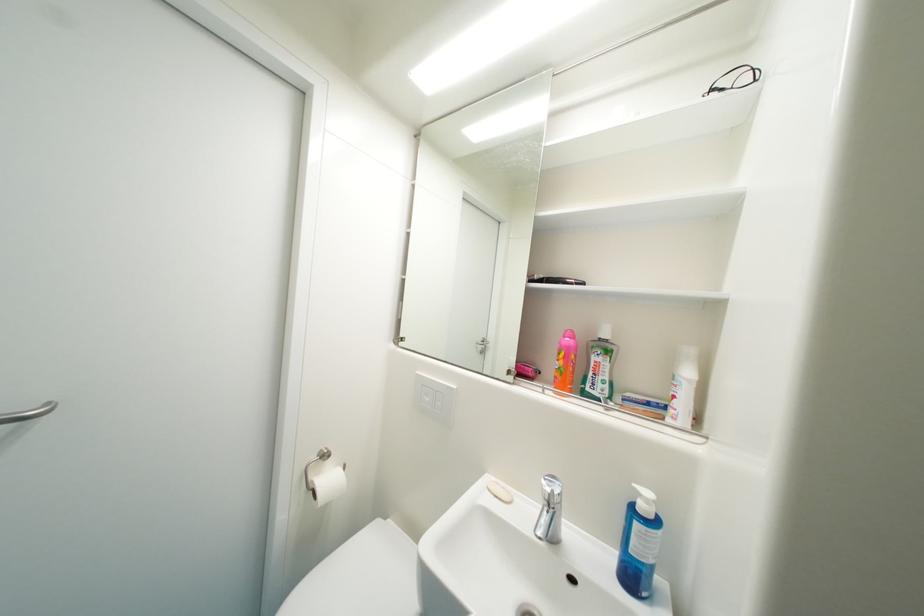
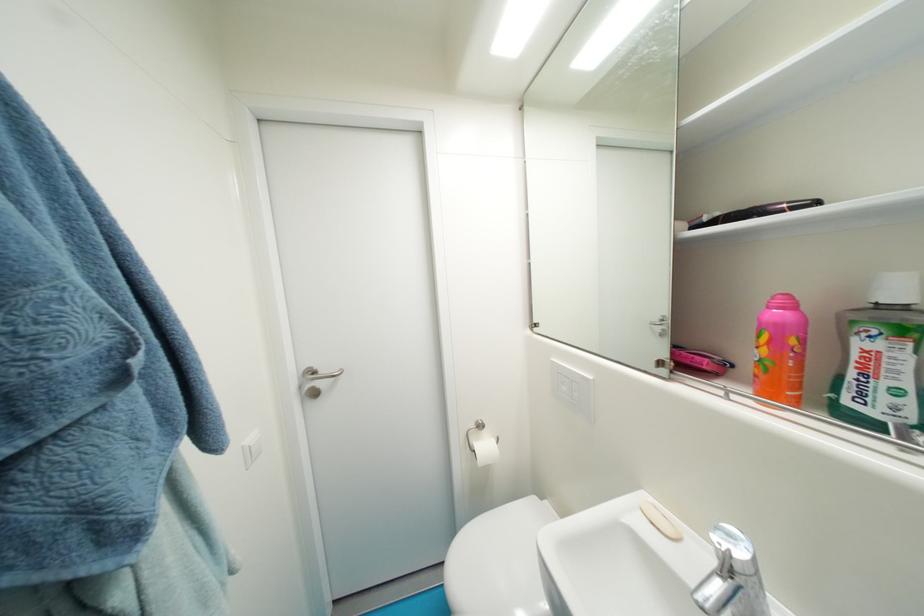
Where in the second image is the point corresponding to (x=560, y=493) from the first image?

(736, 553)